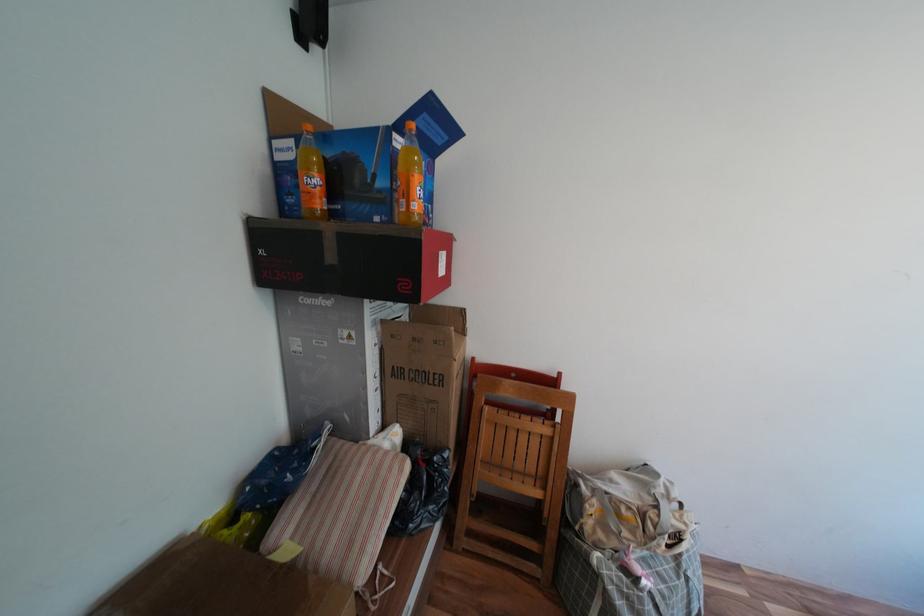
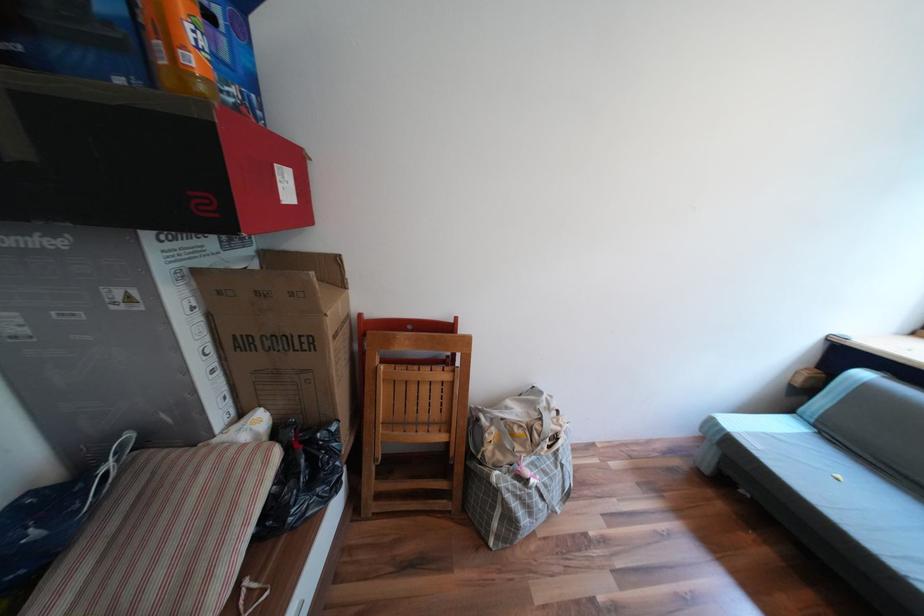
The images are taken continuously from a first-person perspective. In which direction are you moving?

The cameraman walked toward right, forward.